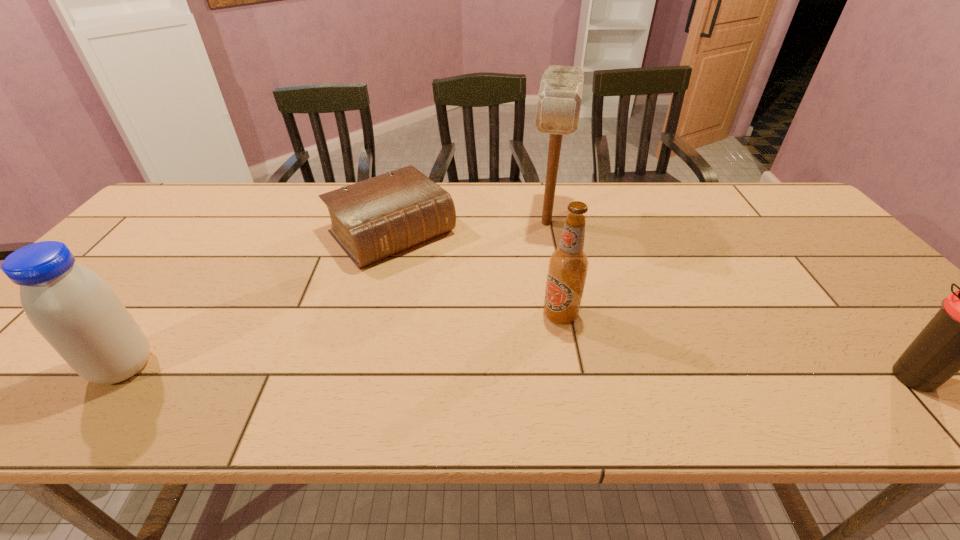
The image size is (960, 540). I want to click on free region that satisfies the following two spatial constraints: 1. on the back side of the Bible; 2. on the right side of the leftmost object, so click(x=225, y=233).